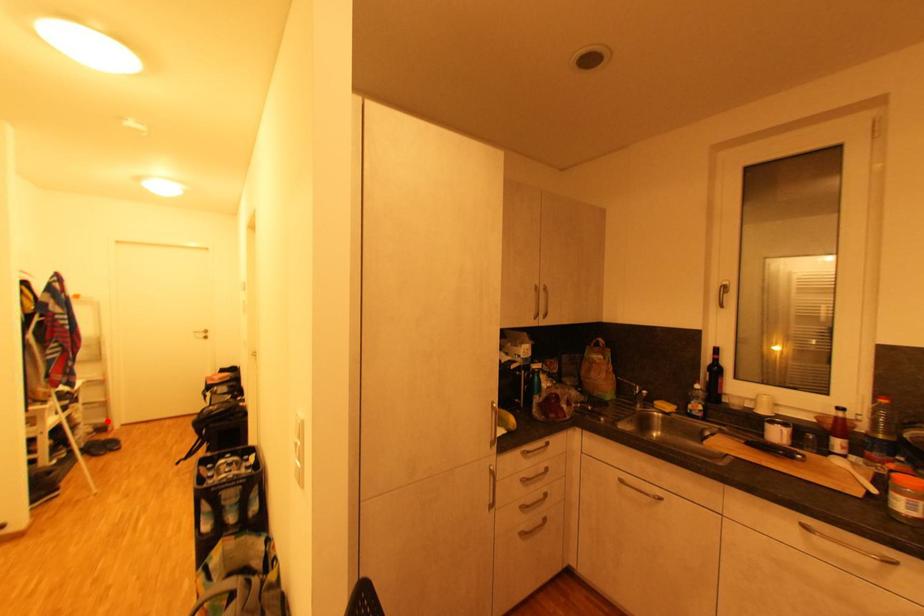
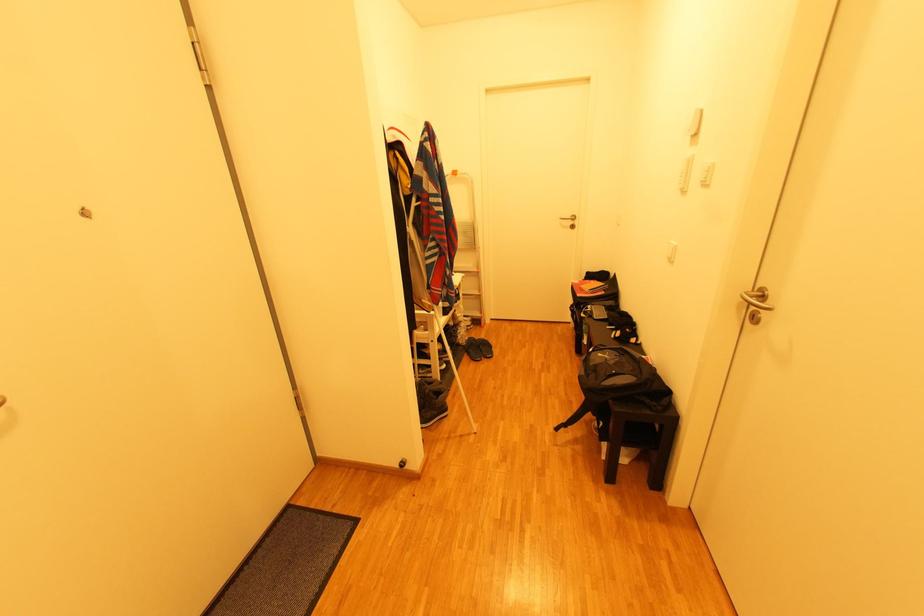
Where in the second image is the point corresponding to the highlighted location from the first image?

(481, 315)